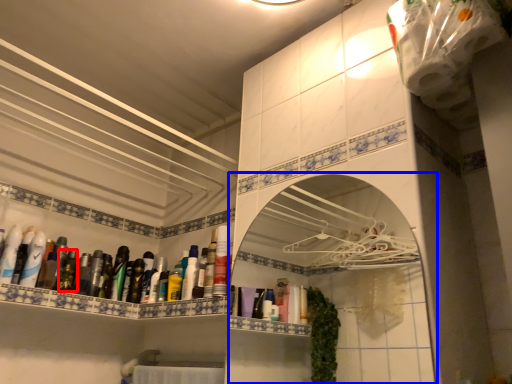
Question: Which of the following is the closest to the observer, mouthwash (highlighted by a red box) or medicine cabinet (highlighted by a blue box)?

Choices:
 (A) mouthwash
 (B) medicine cabinet

Answer: (B)